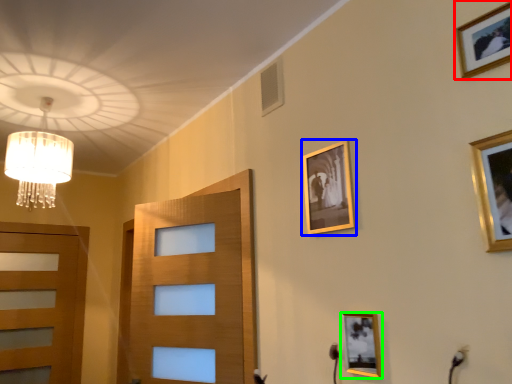
Question: Based on their relative distances, which object is farther from picture frame (highlighted by a red box)? Choose from picture frame (highlighted by a blue box) and picture frame (highlighted by a green box).

Choices:
 (A) picture frame
 (B) picture frame

Answer: (B)